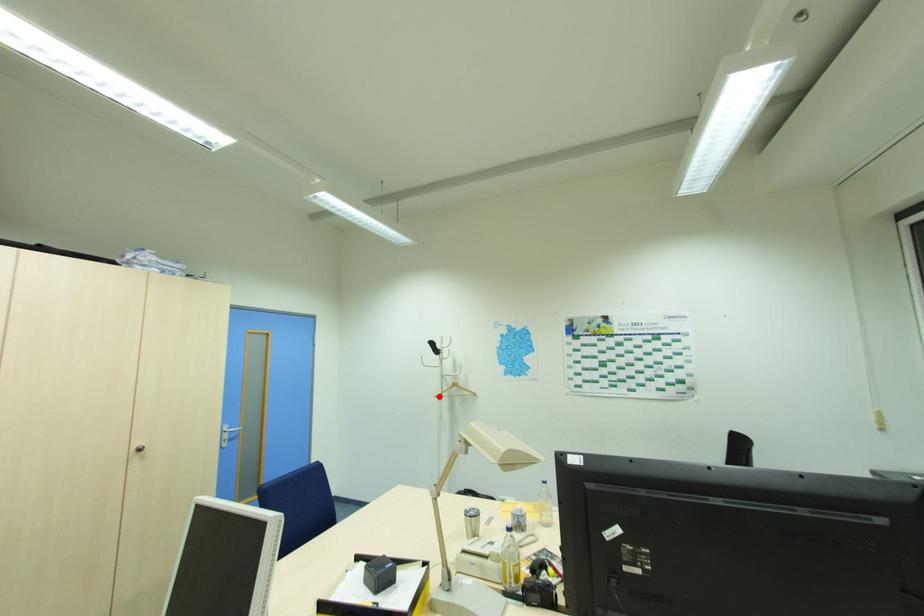
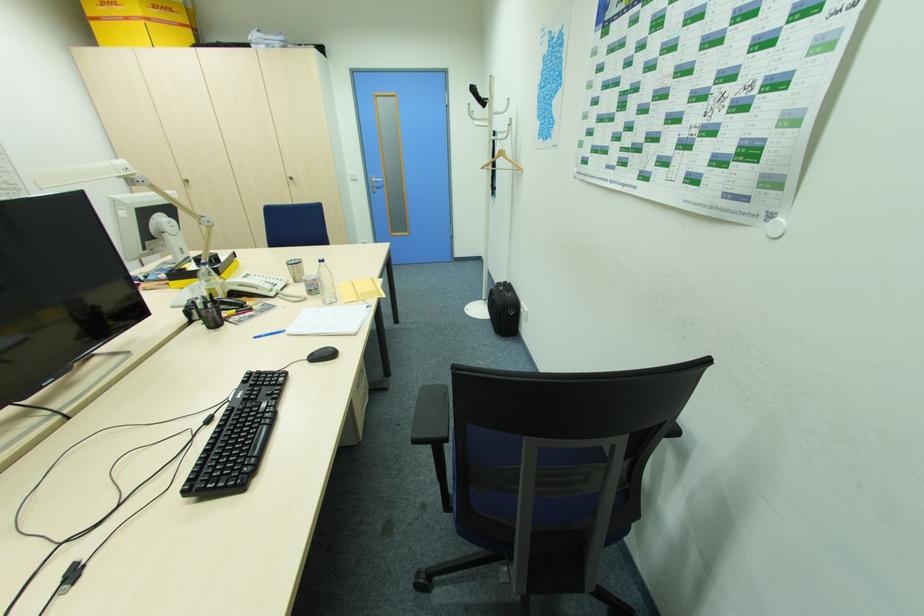
Question: I am providing you with two images of the same scene from different viewpoints. A red point is marked on the first image. At the location where the point appears in image 1, is it still visible in image 2?

Choices:
 (A) Yes
 (B) No

Answer: (A)